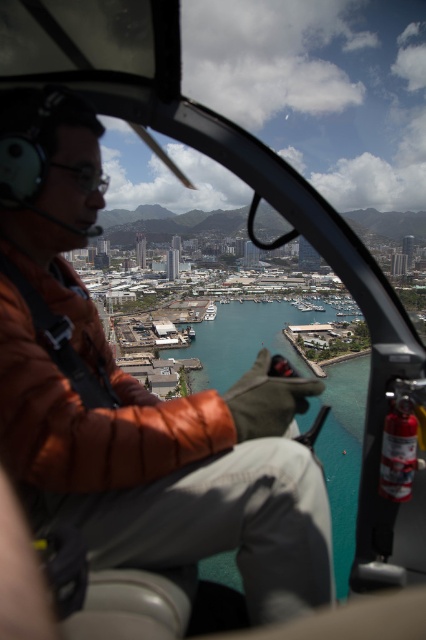
Which is more to the right, brown leather jacket at center or teal glossy water at center?

From the viewer's perspective, teal glossy water at center appears more on the right side.

Can you confirm if brown leather jacket at center is smaller than teal glossy water at center?

No.

Who is more forward, (x=181, y=518) or (x=357, y=461)?

Point (x=181, y=518) is in front.

I want to click on brown leather jacket at center, so click(x=137, y=401).